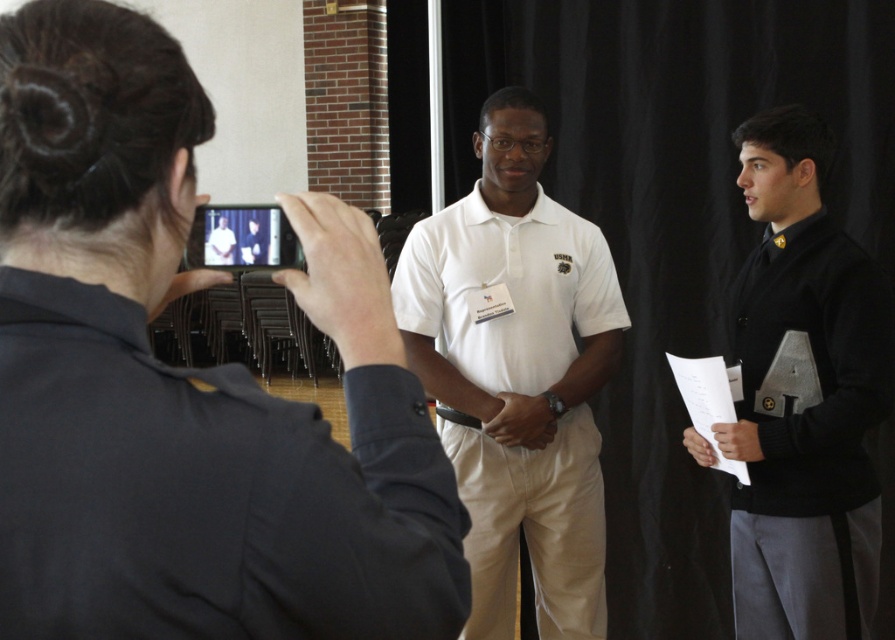
Does black fabric at upper left come in front of white matte shirt at center?

Yes, black fabric at upper left is closer to the viewer.

Where is `black fabric at upper left`? The image size is (895, 640). black fabric at upper left is located at coordinates (186, 384).

You are a GUI agent. You are given a task and a screenshot of the screen. Output one action in this format:
    pyautogui.click(x=<x>, y=<y>)
    Task: Click on the black fabric at upper left
    The image size is (895, 640).
    Given the screenshot: What is the action you would take?
    pyautogui.click(x=186, y=384)

Does white matte shirt at center have a lesser height compared to black matte sweater at center?

In fact, white matte shirt at center may be taller than black matte sweater at center.

Is point (591, 262) more distant than point (870, 627)?

No, it is not.

Find the location of `white matte shirt at center`. white matte shirt at center is located at coordinates (517, 372).

Does black fabric at upper left have a larger size compared to black matte sweater at center?

Incorrect, black fabric at upper left is not larger than black matte sweater at center.

Does black fabric at upper left lie in front of black matte sweater at center?

That is True.

Which is behind, point (27, 360) or point (834, 364)?

Positioned behind is point (834, 364).

I want to click on black fabric at upper left, so click(x=186, y=384).